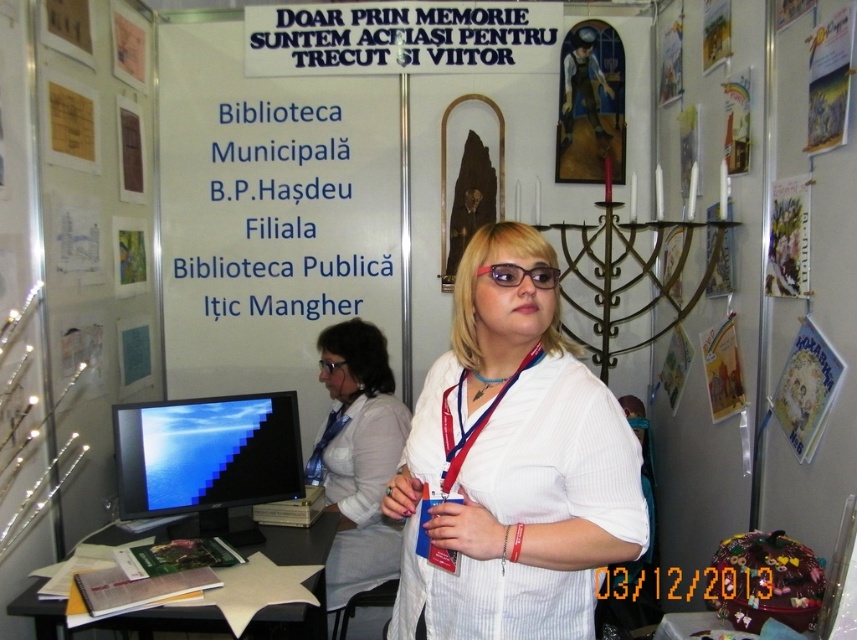
Question: Does matte paper poster at upper right have a greater width compared to matte black glasses at center?

Choices:
 (A) no
 (B) yes

Answer: (A)

Question: Which of the following is the closest to the observer?

Choices:
 (A) matte black glasses at center
 (B) red fabric lanyard at center
 (C) matte paper poster at upper right

Answer: (B)

Question: Is matte black glasses at center below transparent plastic glasses at center?

Choices:
 (A) no
 (B) yes

Answer: (A)

Question: Which point is farther to the camera?

Choices:
 (A) (352, 484)
 (B) (453, 385)
 (C) (387, 636)
 (D) (496, 280)

Answer: (A)

Question: Estimate the real-world distances between objects in this image. Which object is closer to the matte paper poster at upper right?

Choices:
 (A) white fabric shirt at center
 (B) matte black monitor at lower left
 (C) red fabric lanyard at center

Answer: (C)

Question: Can you confirm if matte paper poster at upper right is smaller than matte black glasses at center?

Choices:
 (A) no
 (B) yes

Answer: (A)